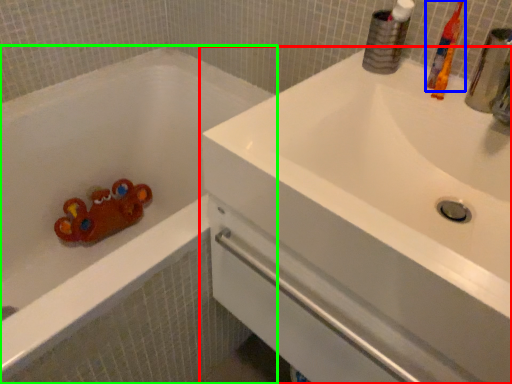
Question: Based on their relative distances, which object is farther from sink (highlighted by a red box)? Choose from toothbrush (highlighted by a blue box) and bathtub (highlighted by a green box).

Choices:
 (A) toothbrush
 (B) bathtub

Answer: (B)